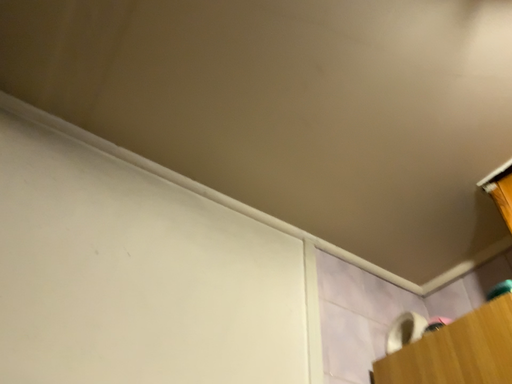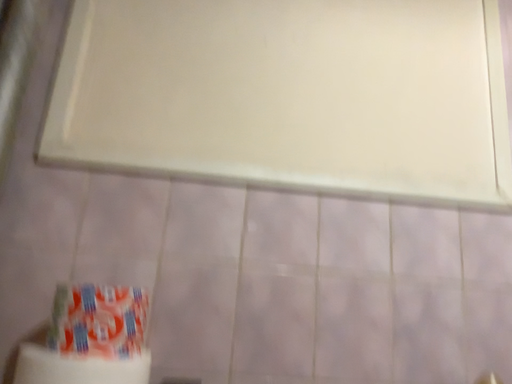
Question: How did the camera likely rotate when shooting the video?

Choices:
 (A) rotated right
 (B) rotated left

Answer: (B)